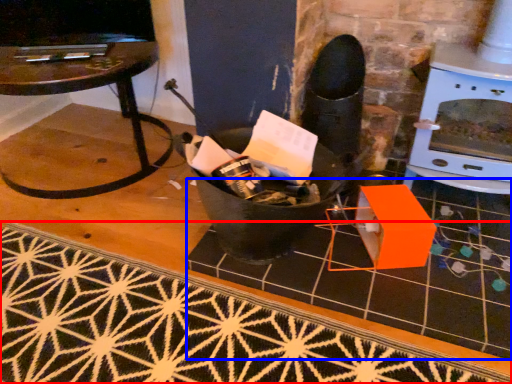
Question: Which point is closer to the camera, doormat (highlighted by a red box) or tile (highlighted by a blue box)?

Choices:
 (A) doormat
 (B) tile

Answer: (A)